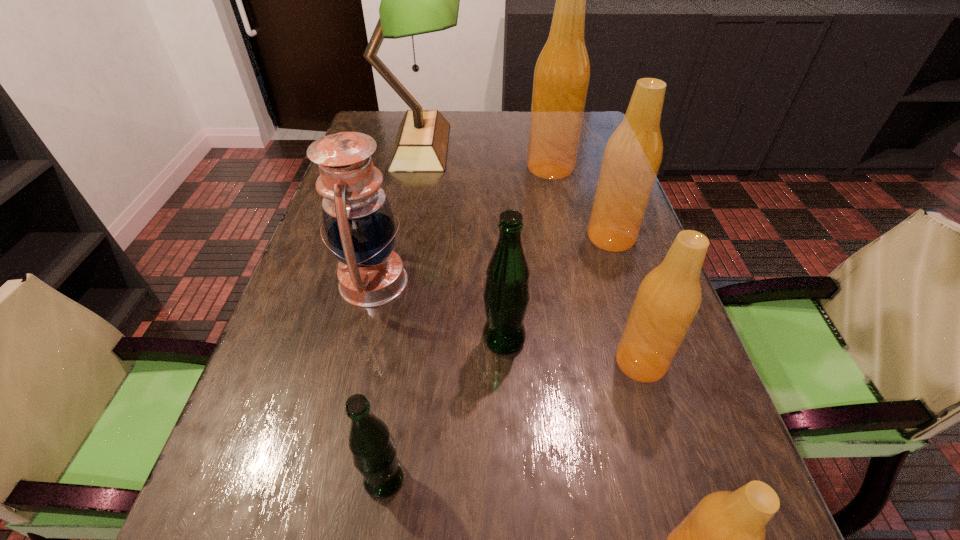
At what (x,y) coordinates should I click in order to perform the action: click on oil lamp that is at the left edge. Please return your answer as a coordinate pair (x, y). The image size is (960, 540). Looking at the image, I should click on (358, 221).

Find the location of a particular element. This screenshot has width=960, height=540. object present at the far left corner is located at coordinates (415, 0).

Where is `free space at the left edge`? The height and width of the screenshot is (540, 960). free space at the left edge is located at coordinates (290, 350).

The height and width of the screenshot is (540, 960). In the image, there is a desktop. Identify the location of vacant space at the right edge. (668, 454).

Find the location of `free spot between the table lamp and the farther green beer bottle`. free spot between the table lamp and the farther green beer bottle is located at coordinates (463, 243).

Where is `vacant area between the third biggest tan beer bottle and the tallest beer bottle`? This screenshot has width=960, height=540. vacant area between the third biggest tan beer bottle and the tallest beer bottle is located at coordinates (595, 265).

At what (x,y) coordinates should I click in order to perform the action: click on vacant area that lies between the second tallest beer bottle and the third farthest tan beer bottle. Please return your answer as a coordinate pair (x, y). Image resolution: width=960 pixels, height=540 pixels. Looking at the image, I should click on (626, 300).

Locate an element on the screen. Image resolution: width=960 pixels, height=540 pixels. free area in between the farthest beer bottle and the right green beer bottle is located at coordinates (527, 253).

You are a GUI agent. You are given a task and a screenshot of the screen. Output one action in this format:
    pyautogui.click(x=<x>, y=<y>)
    Task: Click on the vacant area that lies between the farther green beer bottle and the farthest tan beer bottle
    
    Given the screenshot: What is the action you would take?
    pyautogui.click(x=527, y=253)

Where is `free spot between the green table lamp and the third biggest tan beer bottle`? free spot between the green table lamp and the third biggest tan beer bottle is located at coordinates (531, 254).